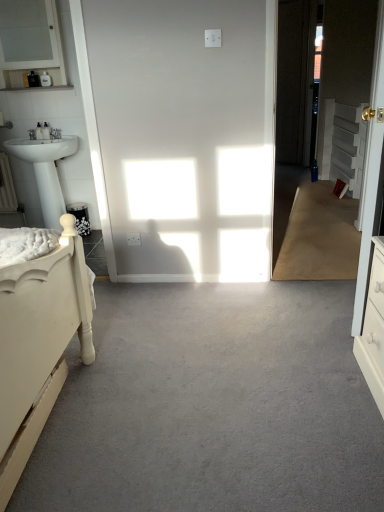
Question: Is matte white cabinet at upper left thinner than white glossy door at right?

Choices:
 (A) yes
 (B) no

Answer: (B)

Question: Would you say matte white cabinet at upper left contains white glossy door at right?

Choices:
 (A) no
 (B) yes

Answer: (A)

Question: Is matte white cabinet at upper left touching white glossy door at right?

Choices:
 (A) no
 (B) yes

Answer: (A)

Question: Is matte white cabinet at upper left taller than white glossy door at right?

Choices:
 (A) yes
 (B) no

Answer: (B)

Question: Is matte white cabinet at upper left looking in the opposite direction of white glossy door at right?

Choices:
 (A) no
 (B) yes

Answer: (A)

Question: Do you think white glossy door at right is within gray carpet at center, or outside of it?

Choices:
 (A) outside
 (B) inside

Answer: (A)

Question: Considering the relative positions of white glossy door at right and gray carpet at center in the image provided, is white glossy door at right to the left or to the right of gray carpet at center?

Choices:
 (A) left
 (B) right

Answer: (B)

Question: From the image's perspective, is white glossy door at right positioned above or below gray carpet at center?

Choices:
 (A) above
 (B) below

Answer: (A)

Question: Is white glossy door at right bigger or smaller than gray carpet at center?

Choices:
 (A) small
 (B) big

Answer: (A)

Question: Would you say matte white cabinet at upper left is to the left or to the right of gray carpet at center in the picture?

Choices:
 (A) left
 (B) right

Answer: (A)

Question: From the image's perspective, relative to gray carpet at center, is matte white cabinet at upper left above or below?

Choices:
 (A) above
 (B) below

Answer: (A)

Question: Is matte white cabinet at upper left in front of or behind gray carpet at center in the image?

Choices:
 (A) front
 (B) behind

Answer: (B)

Question: Is matte white cabinet at upper left wider or thinner than gray carpet at center?

Choices:
 (A) wide
 (B) thin

Answer: (B)

Question: Is white textured cabinet at right situated inside gray carpet at center or outside?

Choices:
 (A) inside
 (B) outside

Answer: (B)

Question: Considering their positions, is white textured cabinet at right located in front of or behind gray carpet at center?

Choices:
 (A) front
 (B) behind

Answer: (B)